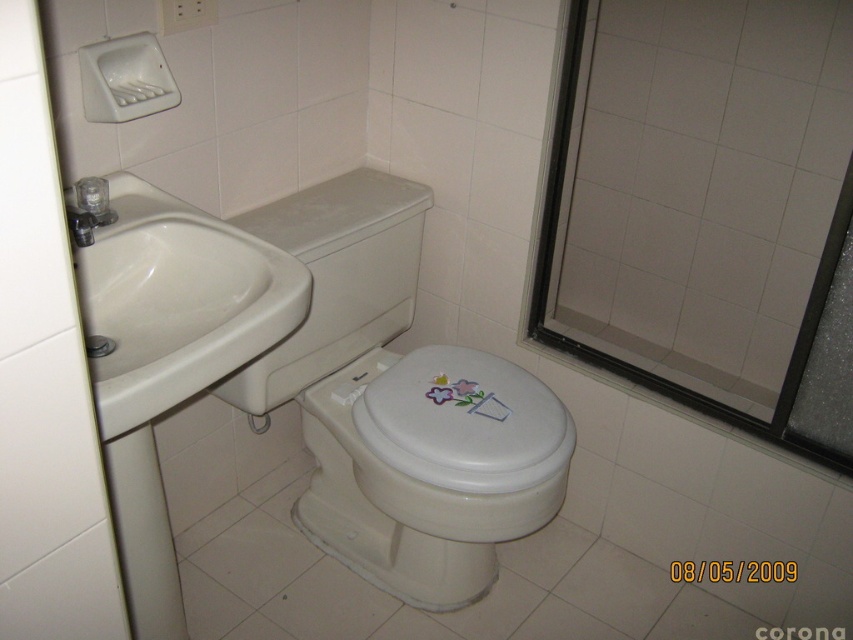
You need to enter the shower but there is a transparent glass door at upper right and a matte silver faucet at left. Which object should you open first to get into the shower?

You should open the transparent glass door at upper right first because it is the entrance to the shower, and the matte silver faucet at left is for water, so you need to open the door before using the faucet.

You are standing in the bathroom and want to place a decorative vase exactly where the white glossy toilet lid at center is located. Is this location feasible?

The white glossy toilet lid at center is located at coordinates (463,420), so placing a decorative vase there would not be feasible as it is the toilet lid itself.